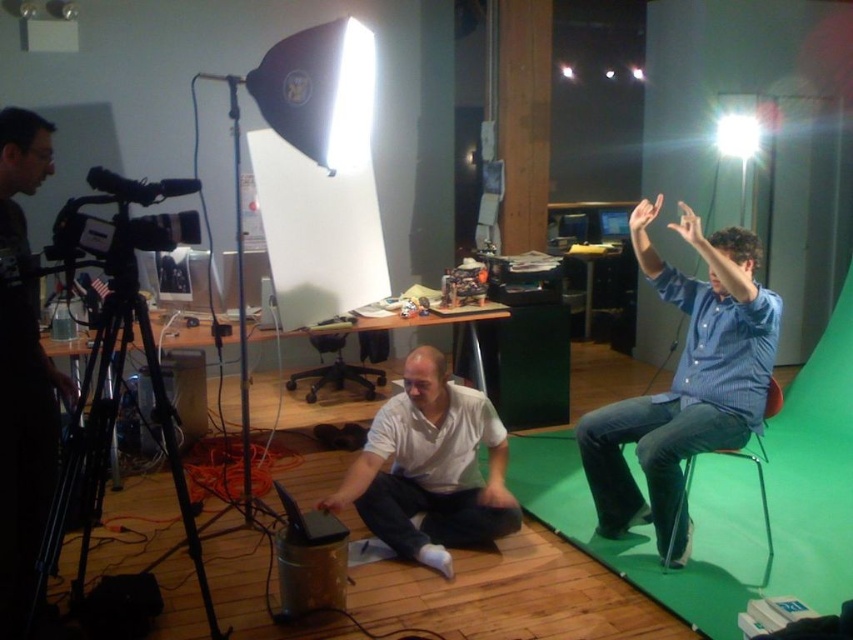
Question: Which point appears closest to the camera in this image?

Choices:
 (A) (727, 305)
 (B) (762, 461)
 (C) (613, 211)
 (D) (36, 410)

Answer: (D)

Question: Which object appears closest to the camera in this image?

Choices:
 (A) black metal tripod at lower left
 (B) blue striped shirt at right

Answer: (A)

Question: Is black matte camera at left below matte black monitor at upper center?

Choices:
 (A) no
 (B) yes

Answer: (B)

Question: Is black matte camera at left positioned at the back of metallic silver chair at right?

Choices:
 (A) yes
 (B) no

Answer: (B)

Question: Observing the image, what is the correct spatial positioning of black metal tripod at lower left in reference to matte black monitor at upper center?

Choices:
 (A) below
 (B) above

Answer: (A)

Question: Estimate the real-world distances between objects in this image. Which object is farther from the metallic silver chair at right?

Choices:
 (A) black metal tripod at lower left
 (B) blue striped shirt at right
 (C) black matte camera at left

Answer: (C)